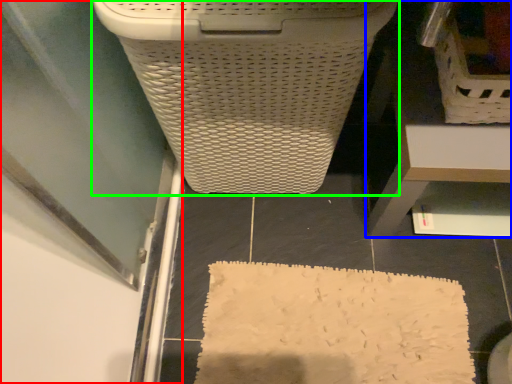
Question: Which object is positioned closest to screen door (highlighted by a red box)? Select from furniture (highlighted by a blue box) and waste container (highlighted by a green box).

Choices:
 (A) furniture
 (B) waste container

Answer: (B)